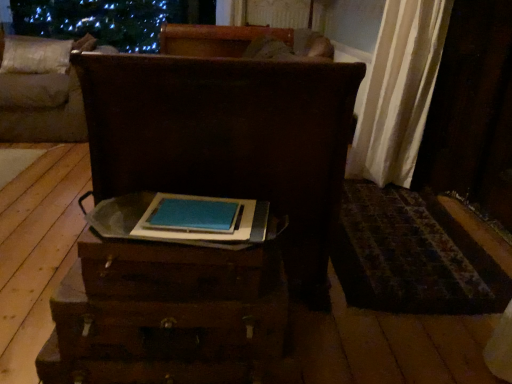
This screenshot has width=512, height=384. What do you see at coordinates (208, 230) in the screenshot?
I see `blue matte book at center` at bounding box center [208, 230].

Identify the location of wooden drawer at center. Image resolution: width=512 pixels, height=384 pixels. (170, 321).

Locate an element on the screen. This screenshot has width=512, height=384. pillow lying on the left of wooden drawer at center is located at coordinates (35, 55).

Considering the positions of points (138, 330) and (5, 50), is point (138, 330) farther from camera compared to point (5, 50)?

That is False.

Considering the sizes of objects wooden drawer at center and beige fabric pillow at upper left in the image provided, who is bigger, wooden drawer at center or beige fabric pillow at upper left?

Bigger between the two is beige fabric pillow at upper left.

Is wooden drawer at center oriented away from beige fabric pillow at upper left?

No, wooden drawer at center is not facing away from beige fabric pillow at upper left.

Find the location of a particular element. book that is below the beige fabric pillow at upper left (from the image's perspective) is located at coordinates pos(208,230).

Is point (192, 231) farther from viewer compared to point (36, 72)?

No, (192, 231) is in front of (36, 72).

Can you see blue matte book at center touching beige fabric pillow at upper left?

No, blue matte book at center is not touching beige fabric pillow at upper left.

From a real-world perspective, which is physically below, blue matte book at center or beige fabric pillow at upper left?

blue matte book at center.

Which furniture is the 2nd one when counting from the back of the blue matte book at center? Please provide its 2D coordinates.

[(41, 91)]

Considering the sizes of objects blue matte book at center and brown wooden chest at upper left, the second furniture viewed from the front, in the image provided, who is smaller, blue matte book at center or brown wooden chest at upper left, the second furniture viewed from the front,?

Smaller between the two is blue matte book at center.

Considering the sizes of objects blue matte book at center and brown wooden chest at upper left, the second furniture viewed from the front, in the image provided, who is wider, blue matte book at center or brown wooden chest at upper left, the second furniture viewed from the front,?

Wider between the two is brown wooden chest at upper left, the second furniture viewed from the front.

Which object is positioned more to the left, blue matte book at center or brown wooden chest at upper left, acting as the 1th furniture starting from the back?

From the viewer's perspective, brown wooden chest at upper left, acting as the 1th furniture starting from the back, appears more on the left side.

Between point (69, 49) and point (241, 241), which one is positioned behind?

The point (69, 49) is more distant.

Does beige fabric pillow at upper left come behind blue matte book at center?

Yes, it is.

Is beige fabric pillow at upper left far away from blue matte book at center?

Yes, beige fabric pillow at upper left and blue matte book at center are located far from each other.

How different are the orientations of wooden trunk at center, which is the second furniture in back-to-front order, and beige fabric pillow at upper left in degrees?

The angular difference between wooden trunk at center, which is the second furniture in back-to-front order, and beige fabric pillow at upper left is 89.7 degrees.

Which object is thinner, wooden trunk at center, marked as the first furniture in a right-to-left arrangement, or beige fabric pillow at upper left?

Thinner between the two is beige fabric pillow at upper left.

Does point (203, 130) come closer to viewer compared to point (61, 51)?

Yes, point (203, 130) is closer to viewer.

Is wooden trunk at center, marked as the first furniture in a right-to-left arrangement, oriented towards beige fabric pillow at upper left?

No, wooden trunk at center, marked as the first furniture in a right-to-left arrangement, is not oriented towards beige fabric pillow at upper left.

Which is more to the left, brown wooden chest at upper left, which ranks as the 1th furniture in left-to-right order, or wooden drawer at center?

Positioned to the left is brown wooden chest at upper left, which ranks as the 1th furniture in left-to-right order.

From a real-world perspective, is brown wooden chest at upper left, acting as the 1th furniture starting from the back, below wooden drawer at center?

No, from a real-world perspective, brown wooden chest at upper left, acting as the 1th furniture starting from the back, is not under wooden drawer at center.

The width and height of the screenshot is (512, 384). In the image, there is a brown wooden chest at upper left, which ranks as the 1th furniture in left-to-right order. Find the location of `drawer below it (from a real-world perspective)`. drawer below it (from a real-world perspective) is located at coordinates pyautogui.click(x=170, y=321).

Looking at their sizes, would you say brown wooden chest at upper left, which appears as the 2th furniture when viewed from the right, is wider or thinner than wooden drawer at center?

Clearly, brown wooden chest at upper left, which appears as the 2th furniture when viewed from the right, has more width compared to wooden drawer at center.

Is beige fabric pillow at upper left next to brown wooden chest at upper left, the second furniture viewed from the front?

No, beige fabric pillow at upper left is not in contact with brown wooden chest at upper left, the second furniture viewed from the front.

Based on their positions, is beige fabric pillow at upper left located to the left or right of brown wooden chest at upper left, which appears as the 2th furniture when viewed from the right?

beige fabric pillow at upper left is to the left of brown wooden chest at upper left, which appears as the 2th furniture when viewed from the right.

Who is taller, beige fabric pillow at upper left or brown wooden chest at upper left, acting as the 1th furniture starting from the back?

brown wooden chest at upper left, acting as the 1th furniture starting from the back, is taller.

Considering the points (10, 60) and (58, 126), which point is behind, point (10, 60) or point (58, 126)?

The point (10, 60) is farther from the camera.

At what (x,y) coordinates should I click in order to perform the action: click on pillow behind the wooden drawer at center. Please return your answer as a coordinate pair (x, y). This screenshot has width=512, height=384. Looking at the image, I should click on (35, 55).

At what (x,y) coordinates should I click in order to perform the action: click on book in front of the beige fabric pillow at upper left. Please return your answer as a coordinate pair (x, y). Looking at the image, I should click on (208, 230).

Looking at the image, which one is located closer to wooden trunk at center, the second furniture viewed from the left, brown wooden chest at upper left, which appears as the 2th furniture when viewed from the right, or blue matte book at center?

Based on the image, blue matte book at center appears to be nearer to wooden trunk at center, the second furniture viewed from the left.

When comparing their distances from blue matte book at center, does beige fabric pillow at upper left or brown wooden chest at upper left, which appears as the 2th furniture when viewed from the right, seem further?

The object further to blue matte book at center is beige fabric pillow at upper left.

Looking at this image, looking at the image, which one is located further to beige fabric pillow at upper left, blue matte book at center or brown wooden chest at upper left, which ranks as the 1th furniture in left-to-right order?

Based on the image, blue matte book at center appears to be further to beige fabric pillow at upper left.

Consider the image. Which object lies further to the anchor point brown wooden chest at upper left, which appears as the 2th furniture when viewed from the right, wooden drawer at center or beige fabric pillow at upper left?

wooden drawer at center lies further to brown wooden chest at upper left, which appears as the 2th furniture when viewed from the right, than the other object.

Considering their positions, is wooden trunk at center, the second furniture viewed from the left, positioned closer to blue matte book at center than brown wooden chest at upper left, acting as the 1th furniture starting from the back?

wooden trunk at center, the second furniture viewed from the left.

Considering their positions, is wooden drawer at center positioned closer to blue matte book at center than wooden trunk at center, the first furniture when ordered from front to back?

wooden drawer at center lies closer to blue matte book at center than the other object.

Looking at the image, which one is located further to blue matte book at center, wooden drawer at center or beige fabric pillow at upper left?

beige fabric pillow at upper left is further to blue matte book at center.

Which object lies nearer to the anchor point brown wooden chest at upper left, acting as the 1th furniture starting from the back, beige fabric pillow at upper left or wooden trunk at center, the second furniture viewed from the left?

beige fabric pillow at upper left is positioned closer to the anchor brown wooden chest at upper left, acting as the 1th furniture starting from the back.

Locate an element on the screen. Image resolution: width=512 pixels, height=384 pixels. furniture between blue matte book at center and brown wooden chest at upper left, acting as the 1th furniture starting from the back, from front to back is located at coordinates (229, 140).

The width and height of the screenshot is (512, 384). Find the location of `drawer between blue matte book at center and brown wooden chest at upper left, acting as the 1th furniture starting from the back, in the front-back direction`. drawer between blue matte book at center and brown wooden chest at upper left, acting as the 1th furniture starting from the back, in the front-back direction is located at coordinates pyautogui.click(x=170, y=321).

Find the location of a particular element. The image size is (512, 384). drawer between blue matte book at center and beige fabric pillow at upper left from front to back is located at coordinates (170, 321).

Locate an element on the screen. This screenshot has height=384, width=512. furniture located between wooden drawer at center and brown wooden chest at upper left, which ranks as the 1th furniture in left-to-right order, in the depth direction is located at coordinates (229, 140).